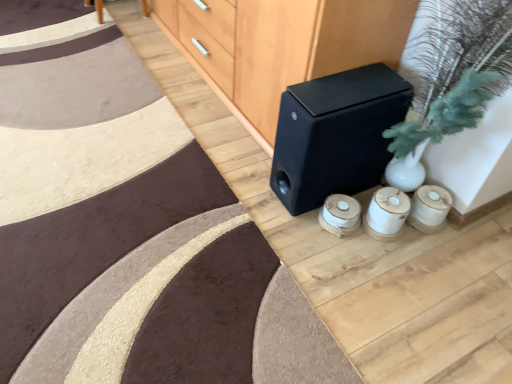
You are a GUI agent. You are given a task and a screenshot of the screen. Output one action in this format:
    pyautogui.click(x=<x>, y=<y>)
    Task: Click on the free space above black matte speaker at center (from a real-world perspective)
    
    Given the screenshot: What is the action you would take?
    pyautogui.click(x=340, y=89)